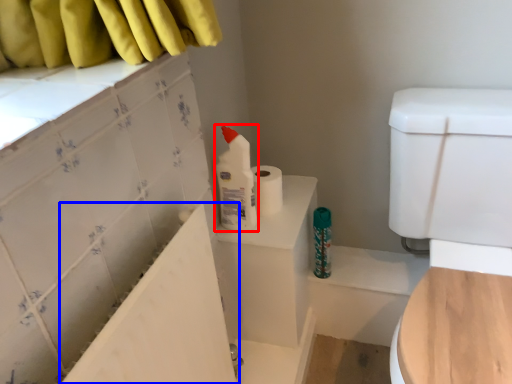
Question: Among these objects, which one is farthest to the camera, cleaning product (highlighted by a red box) or bath (highlighted by a blue box)?

Choices:
 (A) cleaning product
 (B) bath

Answer: (A)